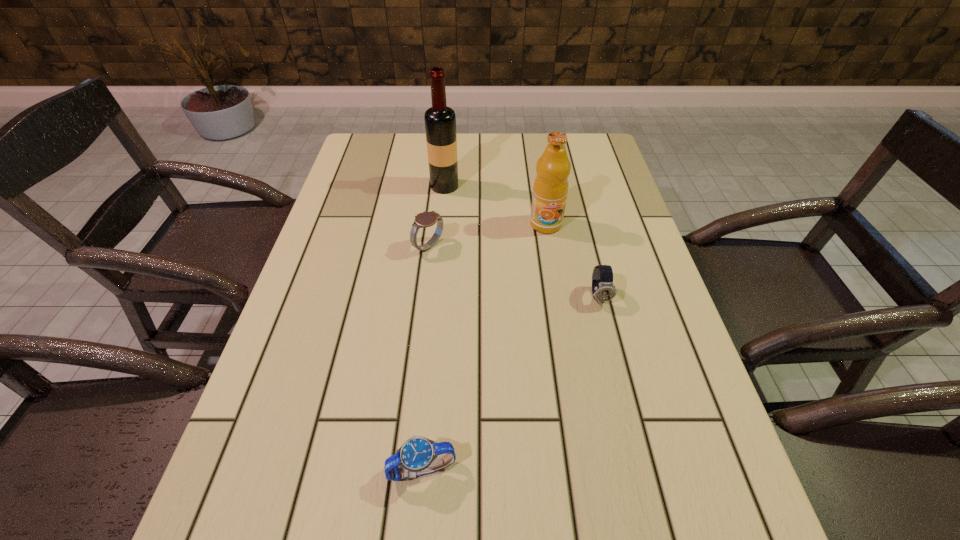
Locate an element on the screen. Image resolution: width=960 pixels, height=540 pixels. free space located on the front label of the fruit juice is located at coordinates (555, 282).

Where is `vacant area situated on the front of the farthest watch`? This screenshot has height=540, width=960. vacant area situated on the front of the farthest watch is located at coordinates (416, 353).

Find the location of `vacant position located on the face of the second nearest watch`. vacant position located on the face of the second nearest watch is located at coordinates (609, 334).

The width and height of the screenshot is (960, 540). In order to click on free spot located 0.060m on the front of the nearest object in this screenshot , I will do `click(417, 529)`.

This screenshot has width=960, height=540. I want to click on object at the right edge, so click(603, 289).

Locate an element on the screen. free point at the far edge is located at coordinates point(480,138).

This screenshot has width=960, height=540. In the image, there is a desktop. What are the coordinates of `vacant space at the left edge` in the screenshot? It's located at (361, 211).

The height and width of the screenshot is (540, 960). In order to click on vacant space at the right edge of the desktop in this screenshot , I will do `click(630, 280)`.

Identify the location of free space at the far right corner. (592, 134).

Where is `blank region between the rightmost watch and the farthest object`? blank region between the rightmost watch and the farthest object is located at coordinates (522, 241).